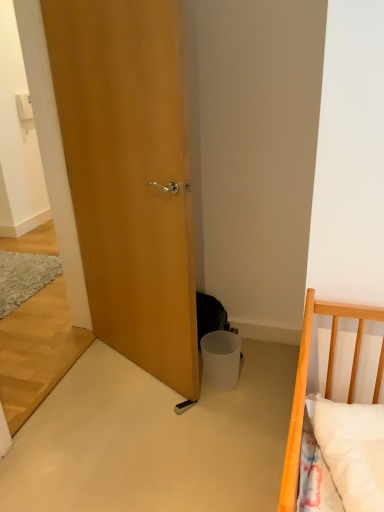
Find the location of `free spot in front of white matte trash bin at lower center`. free spot in front of white matte trash bin at lower center is located at coordinates coord(224,402).